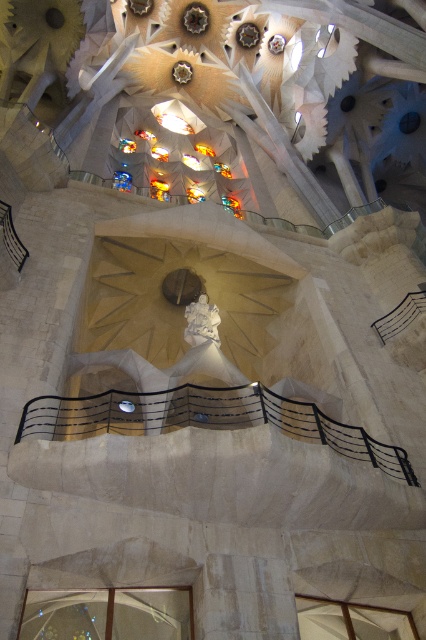
Is point (307, 428) farther from camera compared to point (356, 616)?

Yes, point (307, 428) is behind point (356, 616).

Is black metal railing at center bigger than transparent glass window at lower right?

Correct, black metal railing at center is larger in size than transparent glass window at lower right.

Locate an element on the screen. The height and width of the screenshot is (640, 426). black metal railing at center is located at coordinates (204, 419).

This screenshot has height=640, width=426. Find the location of `black metal railing at center`. black metal railing at center is located at coordinates (204, 419).

Between transparent glass window at lower left and white marble statue at center, which one has less height?

With less height is white marble statue at center.

Which of these two, transparent glass window at lower left or white marble statue at center, stands taller?

transparent glass window at lower left is taller.

Does point (160, 620) come closer to viewer compared to point (210, 323)?

Yes.

I want to click on transparent glass window at lower left, so click(108, 612).

Is point (164, 410) more distant than point (199, 326)?

No, it is not.

Who is positioned more to the right, black metal railing at center or white marble statue at center?

Positioned to the right is black metal railing at center.

What do you see at coordinates (204, 419) in the screenshot? I see `black metal railing at center` at bounding box center [204, 419].

The image size is (426, 640). In order to click on black metal railing at center in this screenshot , I will do `click(204, 419)`.